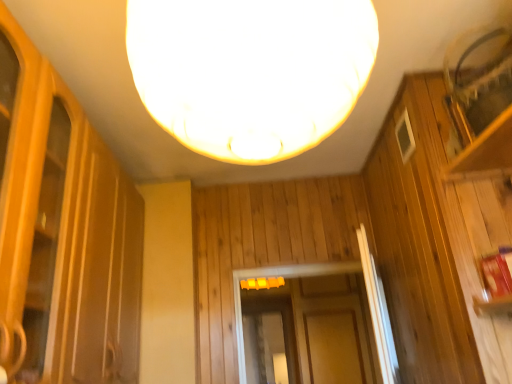
The height and width of the screenshot is (384, 512). Identify the location of white matte lampshade at center. (250, 71).

The image size is (512, 384). Describe the element at coordinates (250, 71) in the screenshot. I see `white matte lampshade at center` at that location.

The image size is (512, 384). Describe the element at coordinates (268, 338) in the screenshot. I see `transparent glass screen door at center` at that location.

Where is `transparent glass screen door at center`? transparent glass screen door at center is located at coordinates (268, 338).

You are a GUI agent. You are given a task and a screenshot of the screen. Output one action in this format:
    pyautogui.click(x=<x>, y=<y>)
    Task: Click on the white matte lampshade at center
    The width and height of the screenshot is (512, 384).
    Given the screenshot: What is the action you would take?
    pyautogui.click(x=250, y=71)

Between white matte lampshade at center and transparent glass screen door at center, which one appears on the left side from the viewer's perspective?

Positioned to the left is white matte lampshade at center.

Looking at this image, considering the positions of objects white matte lampshade at center and transparent glass screen door at center in the image provided, who is behind, white matte lampshade at center or transparent glass screen door at center?

transparent glass screen door at center is further away from the camera.

Is point (234, 93) positioned before point (250, 328)?

Yes, point (234, 93) is in front of point (250, 328).

From the image's perspective, which one is positioned higher, white matte lampshade at center or transparent glass screen door at center?

white matte lampshade at center is shown above in the image.

From a real-world perspective, which object rests below the other?

From a 3D spatial view, transparent glass screen door at center is below.

Considering the sizes of white matte lampshade at center and transparent glass screen door at center in the image, is white matte lampshade at center wider or thinner than transparent glass screen door at center?

In the image, white matte lampshade at center appears to be wider than transparent glass screen door at center.

Considering the sizes of white matte lampshade at center and transparent glass screen door at center in the image, is white matte lampshade at center taller or shorter than transparent glass screen door at center?

white matte lampshade at center is shorter than transparent glass screen door at center.

Is white matte lampshade at center smaller than transparent glass screen door at center?

No, white matte lampshade at center is not smaller than transparent glass screen door at center.

Is white matte lampshade at center not inside transparent glass screen door at center?

Yes, white matte lampshade at center is not within transparent glass screen door at center.

Is white matte lampshade at center touching transparent glass screen door at center?

No, white matte lampshade at center is not making contact with transparent glass screen door at center.

Is transparent glass screen door at center at the back of white matte lampshade at center?

No.

How much distance is there between white matte lampshade at center and transparent glass screen door at center?

10.90 feet.

Identify the location of lamp on the left of transparent glass screen door at center. The image size is (512, 384). (250, 71).

Is transparent glass screen door at center at the left side of white matte lampshade at center?

No.

Is transparent glass screen door at center in front of white matte lampshade at center?

No, it is behind white matte lampshade at center.

Which is further, (x=289, y=348) or (x=340, y=111)?

The point (x=289, y=348) is farther from the camera.

From the image's perspective, is transparent glass screen door at center located beneath white matte lampshade at center?

Yes, from the image's perspective, transparent glass screen door at center is below white matte lampshade at center.

From a real-world perspective, between transparent glass screen door at center and white matte lampshade at center, who is vertically lower?

transparent glass screen door at center, from a real-world perspective.

Which object is wider, transparent glass screen door at center or white matte lampshade at center?

white matte lampshade at center is wider.

Does transparent glass screen door at center have a greater height compared to white matte lampshade at center?

Correct, transparent glass screen door at center is much taller as white matte lampshade at center.

Based on the photo, is transparent glass screen door at center smaller than white matte lampshade at center?

Yes.

Is transparent glass screen door at center located outside white matte lampshade at center?

Yes.

Would you say transparent glass screen door at center is a long distance from white matte lampshade at center?

Yes, transparent glass screen door at center and white matte lampshade at center are quite far apart.

Does transparent glass screen door at center turn towards white matte lampshade at center?

No, transparent glass screen door at center is not facing towards white matte lampshade at center.

Can you tell me how much transparent glass screen door at center and white matte lampshade at center differ in facing direction?

93.2 degrees separate the facing orientations of transparent glass screen door at center and white matte lampshade at center.

How far apart are transparent glass screen door at center and white matte lampshade at center?

transparent glass screen door at center and white matte lampshade at center are 10.90 feet apart.

At what (x,y) coordinates should I click in order to perform the action: click on lamp that is above the transparent glass screen door at center (from the image's perspective). Please return your answer as a coordinate pair (x, y). The image size is (512, 384). Looking at the image, I should click on (250, 71).

What are the coordinates of `lamp lying above the transparent glass screen door at center (from the image's perspective)` in the screenshot? It's located at pos(250,71).

Locate an element on the screen. screen door that appears below the white matte lampshade at center (from a real-world perspective) is located at coordinates (268, 338).